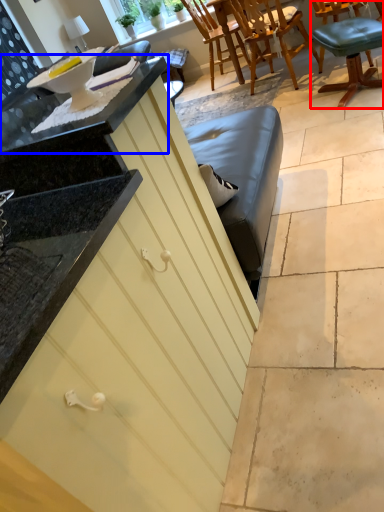
Question: Which object appears farthest to the camera in this image, chair (highlighted by a red box) or countertop (highlighted by a blue box)?

Choices:
 (A) chair
 (B) countertop

Answer: (A)